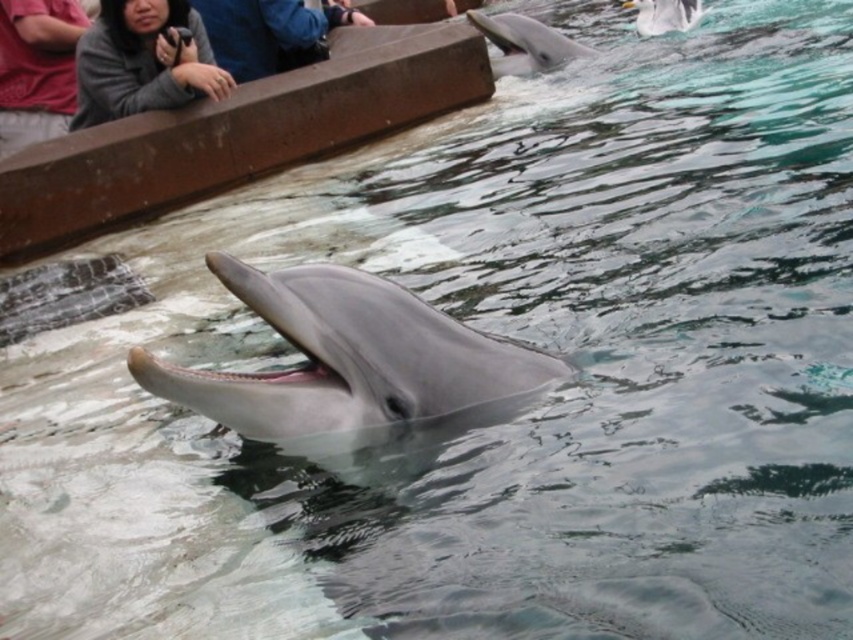
You are a photographer trying to capture the dolphin show. You notice two sleek gray dolphin at center and sleek gray dolphin at upper center in your viewfinder. Which dolphin should you focus on to get a clearer image?

The sleek gray dolphin at center is closer to the viewer than the sleek gray dolphin at upper center, so focusing on the sleek gray dolphin at center will result in a clearer image.

You are standing at the dolphin show and want to take a photo of both the dolphin and the audience. The dolphin is at point (172,54) and the audience is at point (16,106). Since you can only focus on one point at a time, which point should you focus on to ensure the dolphin is in front of the audience in the photo?

You should focus on point (172,54) because it is in front of point (16,106), so the dolphin will appear in front of the audience in the photo.